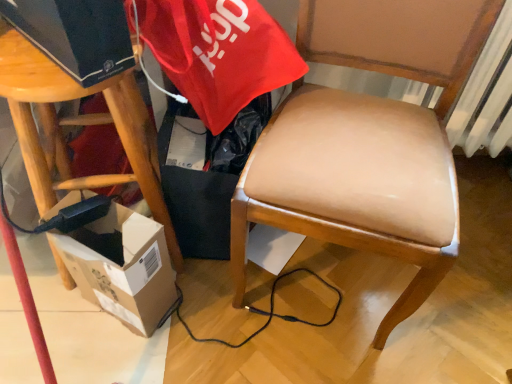
The width and height of the screenshot is (512, 384). Find the location of `vacant area situated below cardboard box at lower left (from a real-world perspective)`. vacant area situated below cardboard box at lower left (from a real-world perspective) is located at coordinates (125, 326).